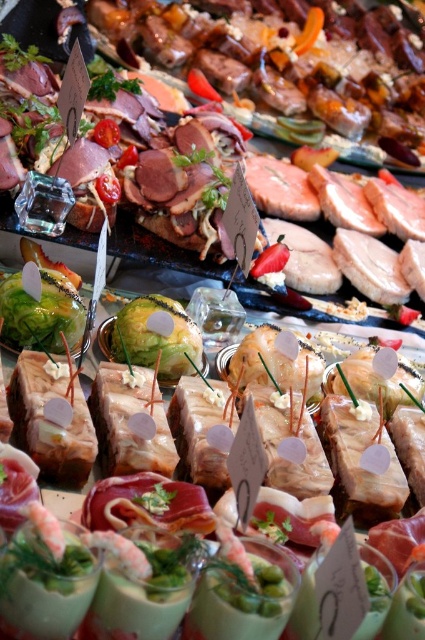
Question: Which point is closer to the camera?

Choices:
 (A) green leafy vegetable at center
 (B) shiny brown meat at upper center

Answer: (A)

Question: Which of the following is the farthest from the observer?

Choices:
 (A) green leafy vegetable at center
 (B) shiny brown meat at upper center

Answer: (B)

Question: Is shiny brown meat at upper center smaller than green leafy vegetable at center?

Choices:
 (A) yes
 (B) no

Answer: (B)

Question: Is shiny brown meat at upper center positioned at the back of green leafy vegetable at center?

Choices:
 (A) no
 (B) yes

Answer: (B)

Question: Does shiny brown meat at upper center have a lesser width compared to green leafy vegetable at center?

Choices:
 (A) yes
 (B) no

Answer: (B)